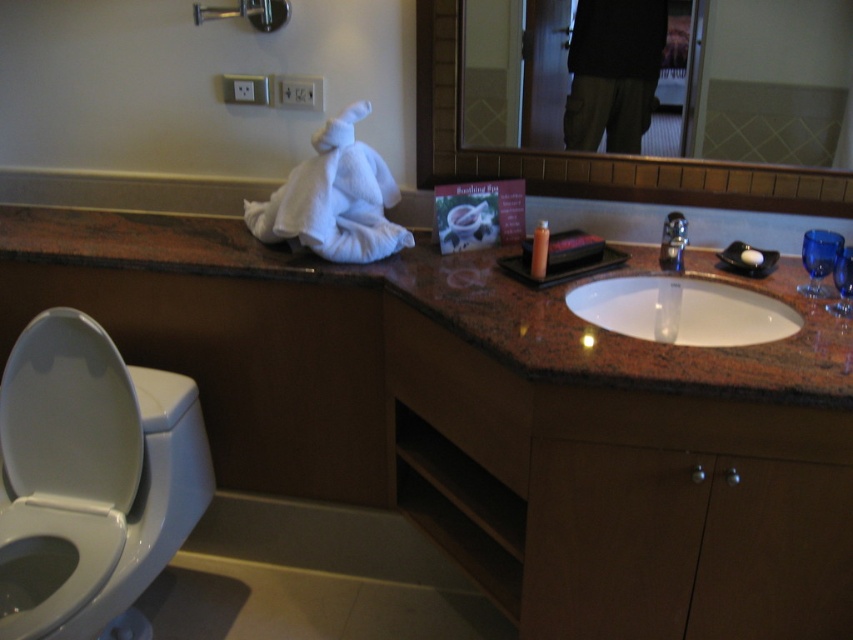
Which of these two, white fluffy towel at center or satin nickel faucet at sink center, stands shorter?

satin nickel faucet at sink center is shorter.

Does white fluffy towel at center lie behind satin nickel faucet at sink center?

No.

Image resolution: width=853 pixels, height=640 pixels. Find the location of `white fluffy towel at center`. white fluffy towel at center is located at coordinates (334, 198).

What are the coordinates of `white fluffy towel at center` in the screenshot? It's located at (334, 198).

Is brown granite countertop at center to the left of dark fabric pants at upper center from the viewer's perspective?

Yes, brown granite countertop at center is to the left of dark fabric pants at upper center.

Is brown granite countertop at center closer to camera compared to dark fabric pants at upper center?

Yes.

Does point (780, 349) lie in front of point (624, 12)?

That is True.

Where is `brown granite countertop at center`? brown granite countertop at center is located at coordinates (456, 304).

Is brown polished granite vanity at center above white glossy toilet bowl at lower left?

Correct, brown polished granite vanity at center is located above white glossy toilet bowl at lower left.

Is point (311, 355) closer to viewer compared to point (28, 525)?

No, (311, 355) is further to viewer.

Identify the location of brown polished granite vanity at center. The height and width of the screenshot is (640, 853). (491, 419).